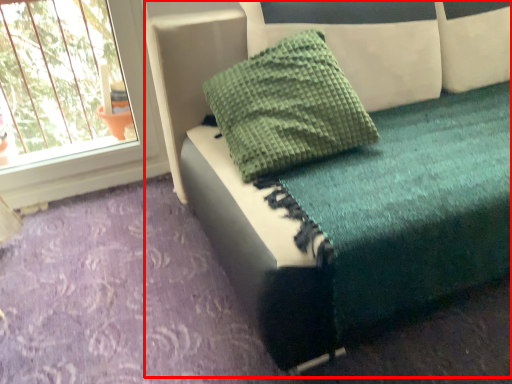
Question: Considering the relative positions of furniture (annotated by the red box) and pillow in the image provided, where is furniture (annotated by the red box) located with respect to the staircase?

Choices:
 (A) left
 (B) right

Answer: (B)